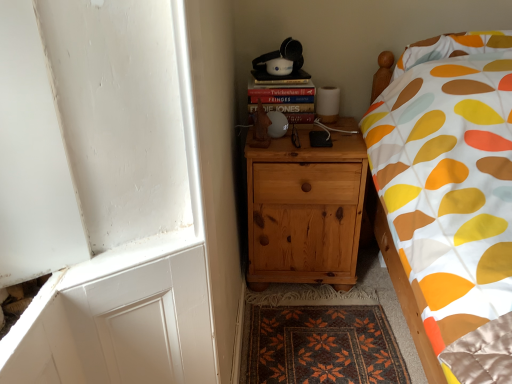
Question: From the image's perspective, is dark brown woven mat at lower center located above hardcover book at upper right?

Choices:
 (A) no
 (B) yes

Answer: (A)

Question: Is dark brown woven mat at lower center thinner than hardcover book at upper right?

Choices:
 (A) yes
 (B) no

Answer: (B)

Question: Is dark brown woven mat at lower center directly adjacent to hardcover book at upper right?

Choices:
 (A) yes
 (B) no

Answer: (B)

Question: Does dark brown woven mat at lower center have a larger size compared to hardcover book at upper right?

Choices:
 (A) yes
 (B) no

Answer: (A)

Question: Considering the relative positions of dark brown woven mat at lower center and hardcover book at upper right in the image provided, is dark brown woven mat at lower center in front of hardcover book at upper right?

Choices:
 (A) yes
 (B) no

Answer: (A)

Question: Considering the positions of dark brown woven mat at lower center and hardcover book at upper right in the image, is dark brown woven mat at lower center taller or shorter than hardcover book at upper right?

Choices:
 (A) short
 (B) tall

Answer: (A)

Question: From the image's perspective, is dark brown woven mat at lower center above or below hardcover book at upper right?

Choices:
 (A) above
 (B) below

Answer: (B)

Question: Considering the positions of dark brown woven mat at lower center and hardcover book at upper right in the image, is dark brown woven mat at lower center bigger or smaller than hardcover book at upper right?

Choices:
 (A) small
 (B) big

Answer: (B)

Question: Is dark brown woven mat at lower center inside or outside of hardcover book at upper right?

Choices:
 (A) outside
 (B) inside

Answer: (A)

Question: From the image's perspective, is natural wood nightstand at center positioned above or below hardcover book at upper right?

Choices:
 (A) below
 (B) above

Answer: (A)

Question: In the image, is natural wood nightstand at center positioned in front of or behind hardcover book at upper right?

Choices:
 (A) behind
 (B) front

Answer: (B)

Question: Is natural wood nightstand at center wider or thinner than hardcover book at upper right?

Choices:
 (A) thin
 (B) wide

Answer: (B)

Question: Considering the positions of natural wood nightstand at center and hardcover book at upper right in the image, is natural wood nightstand at center taller or shorter than hardcover book at upper right?

Choices:
 (A) tall
 (B) short

Answer: (A)

Question: Choose the correct answer: Is dark brown woven mat at lower center inside wooden statue at center or outside it?

Choices:
 (A) outside
 (B) inside

Answer: (A)

Question: Looking at the image, does dark brown woven mat at lower center seem bigger or smaller compared to wooden statue at center?

Choices:
 (A) big
 (B) small

Answer: (A)